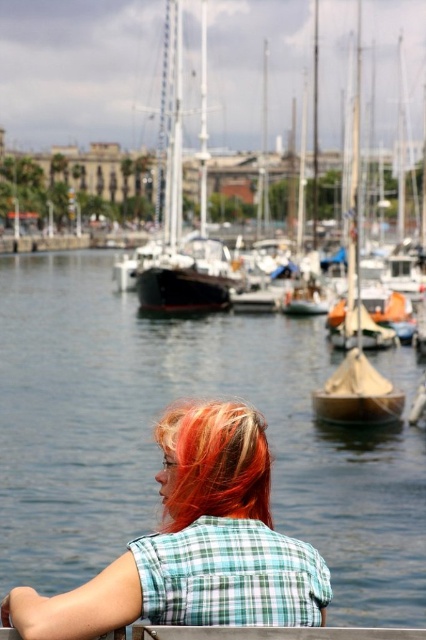
Between green plaid shirt at center and wooden sailboat at center, which one has more height?

wooden sailboat at center is taller.

Is green plaid shirt at center to the left of wooden sailboat at center from the viewer's perspective?

Incorrect, green plaid shirt at center is not on the left side of wooden sailboat at center.

Where is `green plaid shirt at center`? Image resolution: width=426 pixels, height=640 pixels. green plaid shirt at center is located at coordinates (230, 576).

In order to click on green plaid shirt at center in this screenshot , I will do `click(230, 576)`.

Does clear blue water at center have a lesser width compared to wooden sailboat at center?

In fact, clear blue water at center might be wider than wooden sailboat at center.

Can you confirm if clear blue water at center is positioned above wooden sailboat at center?

Actually, clear blue water at center is below wooden sailboat at center.

The width and height of the screenshot is (426, 640). What are the coordinates of `clear blue water at center` in the screenshot? It's located at (158, 451).

The image size is (426, 640). I want to click on clear blue water at center, so click(x=158, y=451).

Who is more distant from viewer, [249,595] or [218,429]?

Answer: The point [218,429] is more distant.

Does green plaid shirt at center have a greater height compared to shiny orange hair at lower center?

Incorrect, green plaid shirt at center's height is not larger of shiny orange hair at lower center's.

Image resolution: width=426 pixels, height=640 pixels. Identify the location of green plaid shirt at center. (230, 576).

Where is `green plaid shirt at center`? green plaid shirt at center is located at coordinates (230, 576).